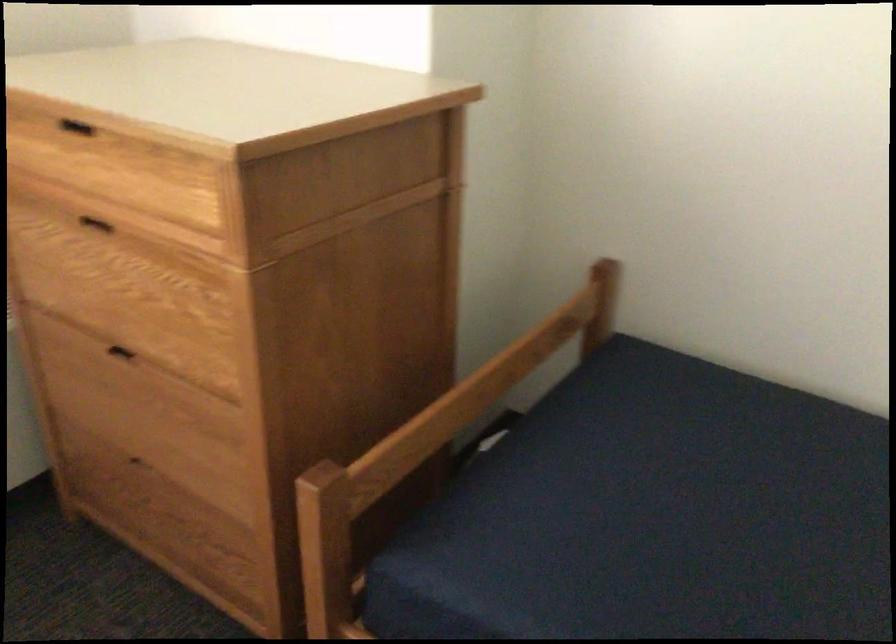
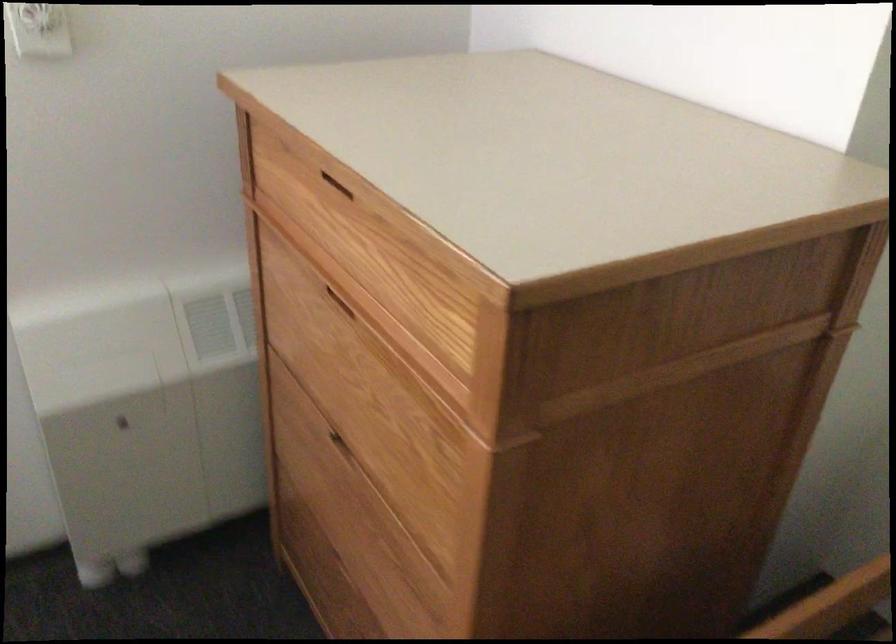
Question: The first image is from the beginning of the video and the second image is from the end. How did the camera likely rotate when shooting the video?

Choices:
 (A) Left
 (B) Right
 (C) Up
 (D) Down

Answer: (A)